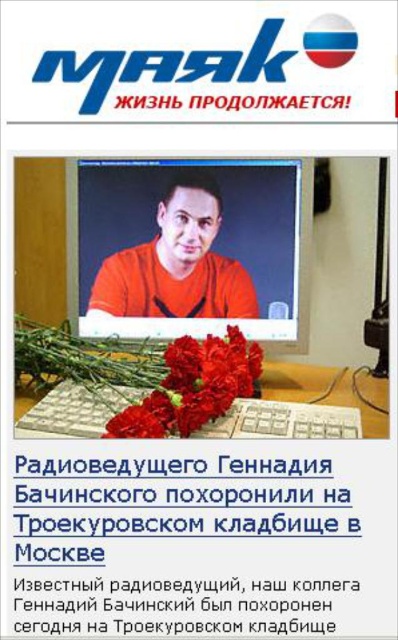
Question: Can you confirm if matte plastic monitor at center is thinner than smooth red carnation at center?

Choices:
 (A) no
 (B) yes

Answer: (A)

Question: Which object appears closest to the camera in this image?

Choices:
 (A) matte plastic monitor at center
 (B) orange matte shirt at center

Answer: (A)

Question: Among these objects, which one is farthest from the camera?

Choices:
 (A) matte plastic keyboard at lower center
 (B) matte plastic monitor at center
 (C) orange matte shirt at center

Answer: (C)

Question: Based on their relative distances, which object is nearer to the matte plastic monitor at center?

Choices:
 (A) matte plastic keyboard at lower center
 (B) white plastic keyboard at lower center
 (C) orange matte shirt at center

Answer: (C)

Question: Is the position of smooth red carnation at center less distant than that of matte plastic keyboard at lower center?

Choices:
 (A) no
 (B) yes

Answer: (B)

Question: Is matte plastic monitor at center above matte plastic keyboard at lower center?

Choices:
 (A) no
 (B) yes

Answer: (B)